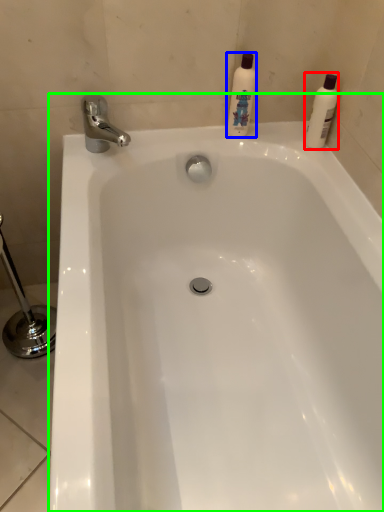
Question: Which is nearer to the cleaning product (highlighted by a red box)? cleaning product (highlighted by a blue box) or bathtub (highlighted by a green box).

Choices:
 (A) cleaning product
 (B) bathtub

Answer: (A)